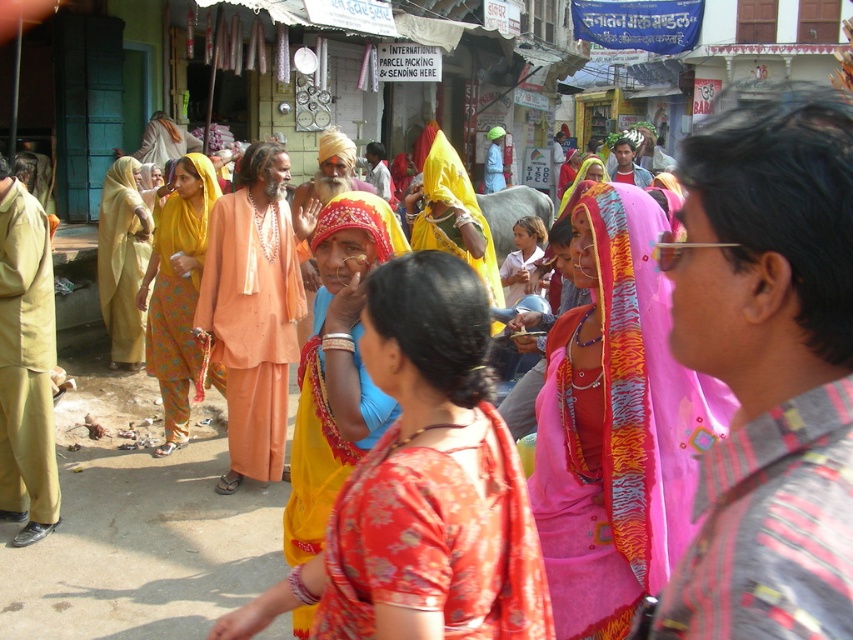
Question: Is orange cotton robe at center positioned before yellow printed sari at center?

Choices:
 (A) no
 (B) yes

Answer: (B)

Question: Which of the following is the farthest from the observer?

Choices:
 (A) khaki cotton robe at left
 (B) orange cotton robe at center
 (C) yellow printed sari at center
 (D) silky red sari at center

Answer: (C)

Question: Is the position of yellow printed sari at center less distant than that of matte orange robe at center?

Choices:
 (A) yes
 (B) no

Answer: (A)

Question: Is yellow fabric sari at center bigger than matte orange robe at center?

Choices:
 (A) no
 (B) yes

Answer: (B)

Question: Considering the real-world distances, which object is closest to the khaki cotton robe at left?

Choices:
 (A) silky red sari at center
 (B) pink fabric at center
 (C) pink satin saree at center

Answer: (C)

Question: Which of the following is the closest to the observer?

Choices:
 (A) (177, 212)
 (B) (546, 561)
 (C) (251, 461)

Answer: (B)